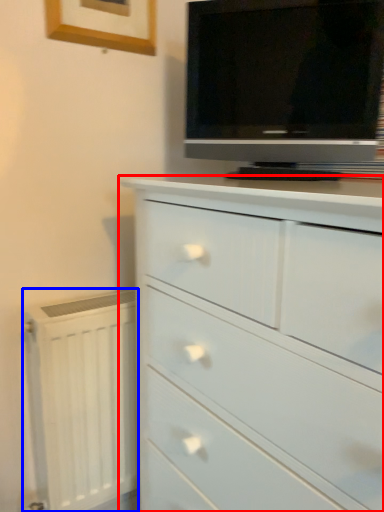
Question: Which object appears farthest to the camera in this image, chest of drawers (highlighted by a red box) or radiator (highlighted by a blue box)?

Choices:
 (A) chest of drawers
 (B) radiator

Answer: (B)